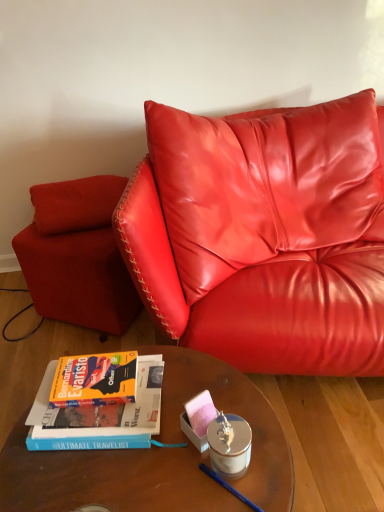
Image resolution: width=384 pixels, height=512 pixels. I want to click on free point in front of silver metallic candle holder at center, so click(x=240, y=494).